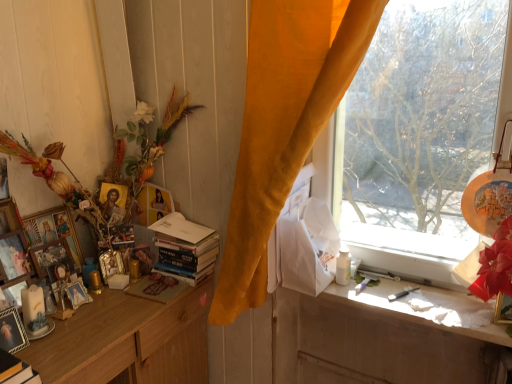
You are a GUI agent. You are given a task and a screenshot of the screen. Output one action in this format:
    pyautogui.click(x=<x>, y=<y>)
    Task: Click on the free space above wooden cabinet at left (from a real-world perspective)
    Image resolution: width=512 pixels, height=384 pixels.
    Given the screenshot: What is the action you would take?
    pyautogui.click(x=99, y=315)